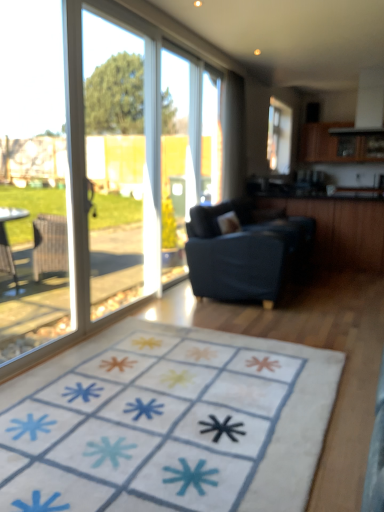
Locate an element on the screen. The image size is (384, 512). transparent plastic window screen at center, placed as the second window screen when sorted from front to back is located at coordinates (211, 140).

At what (x,y) coordinates should I click in order to perform the action: click on transparent glass window at left, the second window screen when ordered from back to front. Please return your answer as a coordinate pair (x, y). The image size is (384, 512). Looking at the image, I should click on [32, 178].

Can you tell me how much transparent plastic window screen at center, placed as the second window screen when sorted from front to back, and transparent glass screen door at left differ in facing direction?

The angular difference between transparent plastic window screen at center, placed as the second window screen when sorted from front to back, and transparent glass screen door at left is 0.00346 degrees.

From the image's perspective, between transparent plastic window screen at center, placed as the second window screen when sorted from front to back, and transparent glass screen door at left, who is located below?

transparent glass screen door at left is shown below in the image.

Between transparent plastic window screen at center, which is the 1th window screen from back to front, and transparent glass screen door at left, which one is positioned behind?

transparent plastic window screen at center, which is the 1th window screen from back to front, is further from the camera.

Considering the positions of points (214, 83) and (137, 252), is point (214, 83) farther from camera compared to point (137, 252)?

No, it is not.

Could you tell me if dark blue fabric couch at center is facing transparent glass window at left, which is the 1th window screen from left to right?

No, dark blue fabric couch at center is not facing towards transparent glass window at left, which is the 1th window screen from left to right.

Considering the sizes of dark blue fabric couch at center and transparent glass window at left, which is the 1th window screen from left to right, in the image, is dark blue fabric couch at center taller or shorter than transparent glass window at left, which is the 1th window screen from left to right,?

In the image, dark blue fabric couch at center appears to be shorter than transparent glass window at left, which is the 1th window screen from left to right.

Is point (226, 288) in front of point (4, 98)?

Yes.

Between dark blue fabric couch at center and transparent glass window at left, acting as the first window screen starting from the front, which one is positioned behind?

dark blue fabric couch at center is more distant.

From a real-world perspective, is dark blue fabric couch at center over white soft rug at center?

Yes.

Based on the photo, between dark blue fabric couch at center and white soft rug at center, which one is positioned in front?

white soft rug at center is closer to the camera.

I want to click on studio couch behind the white soft rug at center, so click(x=245, y=251).

From the image's perspective, is transparent plastic window screen at center, placed as the second window screen when sorted from front to back, below white sheer curtain at upper center?

Yes, from the image's perspective, transparent plastic window screen at center, placed as the second window screen when sorted from front to back, is below white sheer curtain at upper center.

There is a white sheer curtain at upper center. At what (x,y) coordinates should I click in order to perform the action: click on the 1st window screen below it (from a real-world perspective). Please return your answer as a coordinate pair (x, y). The width and height of the screenshot is (384, 512). Looking at the image, I should click on (211, 140).

Is transparent plastic window screen at center, which is the 1th window screen from back to front, positioned far away from white sheer curtain at upper center?

transparent plastic window screen at center, which is the 1th window screen from back to front, is near white sheer curtain at upper center, not far away.

Could you tell me if transparent plastic window screen at center, the 1th window screen in the right-to-left sequence, is facing white sheer curtain at upper center?

Yes.

Considering the positions of objects white soft rug at center and white sheer curtain at upper center in the image provided, who is more to the right, white soft rug at center or white sheer curtain at upper center?

white sheer curtain at upper center is more to the right.

Where is `doormat located underneath the white sheer curtain at upper center (from a real-world perspective)`? The image size is (384, 512). doormat located underneath the white sheer curtain at upper center (from a real-world perspective) is located at coordinates (167, 423).

Is white soft rug at center situated inside white sheer curtain at upper center or outside?

white soft rug at center exists outside the volume of white sheer curtain at upper center.

Is white soft rug at center facing away from white sheer curtain at upper center?

That's not correct — white soft rug at center is not looking away from white sheer curtain at upper center.

Considering the points (15, 322) and (130, 383), which point is in front, point (15, 322) or point (130, 383)?

The point (130, 383) is more forward.

Measure the distance between transparent glass window at left, which ranks as the 2th window screen in right-to-left order, and white soft rug at center.

A distance of 3.22 meters exists between transparent glass window at left, which ranks as the 2th window screen in right-to-left order, and white soft rug at center.

This screenshot has width=384, height=512. In order to click on doormat that is below the transparent glass window at left, which ranks as the 2th window screen in right-to-left order (from the image's perspective) in this screenshot , I will do `click(167, 423)`.

Is the surface of transparent glass window at left, which is the 1th window screen from left to right, in direct contact with white soft rug at center?

No.

Is transparent glass screen door at left with white soft rug at center?

No, transparent glass screen door at left is not touching white soft rug at center.

From the image's perspective, is transparent glass screen door at left over white soft rug at center?

Yes, from the image's perspective, transparent glass screen door at left is above white soft rug at center.

From a real-world perspective, between transparent glass screen door at left and white soft rug at center, who is vertically higher?

In real-world perspective, transparent glass screen door at left is above.

From the picture: Considering the sizes of objects transparent glass screen door at left and white soft rug at center in the image provided, who is shorter, transparent glass screen door at left or white soft rug at center?

With less height is white soft rug at center.

Locate an element on the screen. window screen above the transparent glass screen door at left (from the image's perspective) is located at coordinates pyautogui.click(x=211, y=140).

Image resolution: width=384 pixels, height=512 pixels. I want to click on studio couch on the right side of transparent glass window at left, which is the 1th window screen from left to right, so click(245, 251).

Based on their spatial positions, is transparent glass screen door at left or dark blue fabric couch at center further from transparent plastic window screen at center, which is counted as the second window screen, starting from the left?

transparent glass screen door at left.

Considering their positions, is dark blue fabric couch at center positioned further to transparent plastic window screen at center, which is counted as the second window screen, starting from the left, than transparent glass window at left, acting as the first window screen starting from the front?

transparent glass window at left, acting as the first window screen starting from the front, is further to transparent plastic window screen at center, which is counted as the second window screen, starting from the left.

Estimate the real-world distances between objects in this image. Which object is closer to transparent glass window at left, the second window screen when ordered from back to front, white sheer curtain at upper center or transparent plastic window screen at center, the 1th window screen in the right-to-left sequence?

Among the two, white sheer curtain at upper center is located nearer to transparent glass window at left, the second window screen when ordered from back to front.

Looking at the image, which one is located further to transparent glass screen door at left, transparent glass window at left, which is the 1th window screen from left to right, or white sheer curtain at upper center?

transparent glass window at left, which is the 1th window screen from left to right, is further to transparent glass screen door at left.

Considering their positions, is transparent plastic window screen at center, which is counted as the second window screen, starting from the left, positioned further to transparent glass screen door at left than dark blue fabric couch at center?

dark blue fabric couch at center is further to transparent glass screen door at left.

Which object lies further to the anchor point transparent glass screen door at left, dark blue fabric couch at center or transparent glass window at left, which is the 1th window screen from left to right?

Among the two, transparent glass window at left, which is the 1th window screen from left to right, is located further to transparent glass screen door at left.

Based on their spatial positions, is white sheer curtain at upper center or transparent plastic window screen at center, which is counted as the second window screen, starting from the left, closer to dark blue fabric couch at center?

Among the two, transparent plastic window screen at center, which is counted as the second window screen, starting from the left, is located nearer to dark blue fabric couch at center.

Which object lies further to the anchor point white sheer curtain at upper center, transparent plastic window screen at center, the 1th window screen in the right-to-left sequence, or white soft rug at center?

white soft rug at center.

Find the location of a particular element. The height and width of the screenshot is (512, 384). screen door located between transparent glass window at left, acting as the first window screen starting from the front, and transparent plastic window screen at center, which is counted as the second window screen, starting from the left, in the depth direction is located at coordinates (120, 164).

This screenshot has height=512, width=384. I want to click on studio couch between transparent glass screen door at left and transparent plastic window screen at center, which is counted as the second window screen, starting from the left, along the z-axis, so click(245, 251).

Where is `screen door between transparent glass window at left, acting as the first window screen starting from the front, and white sheer curtain at upper center, along the z-axis`? The height and width of the screenshot is (512, 384). screen door between transparent glass window at left, acting as the first window screen starting from the front, and white sheer curtain at upper center, along the z-axis is located at coordinates (120, 164).

In order to click on screen door between white soft rug at center and dark blue fabric couch at center along the z-axis in this screenshot , I will do [x=120, y=164].